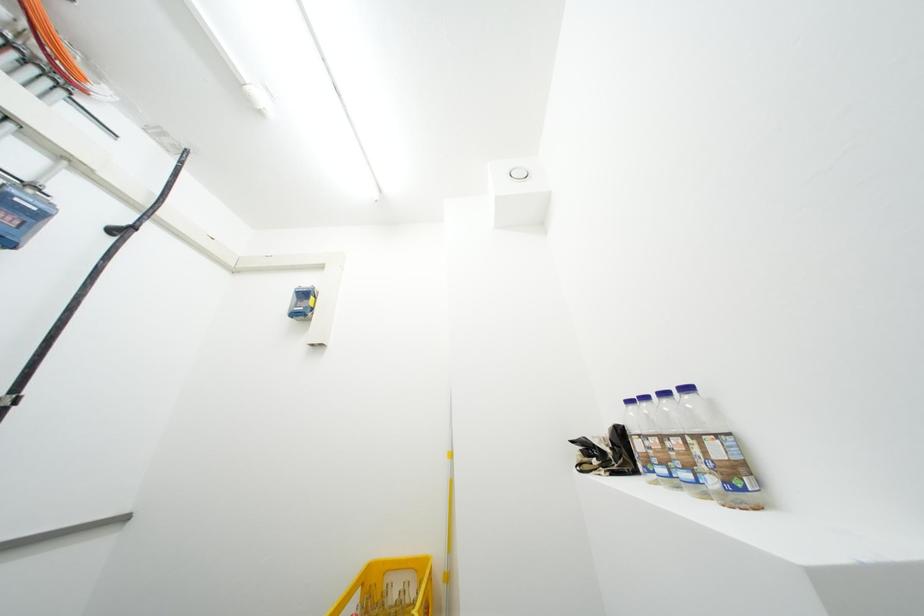
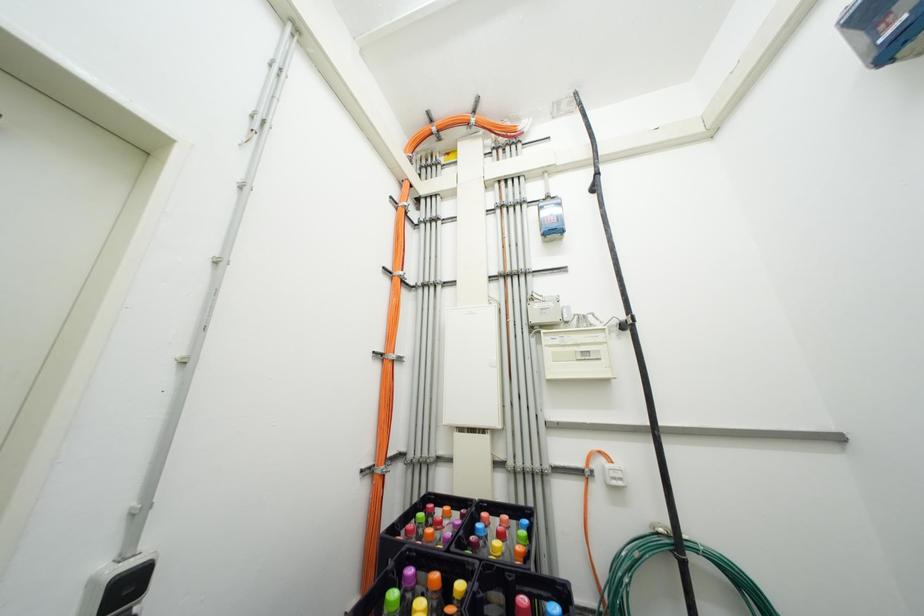
First-person continuous shooting, in which direction is the camera rotating?

The camera's rotation is toward left-up.